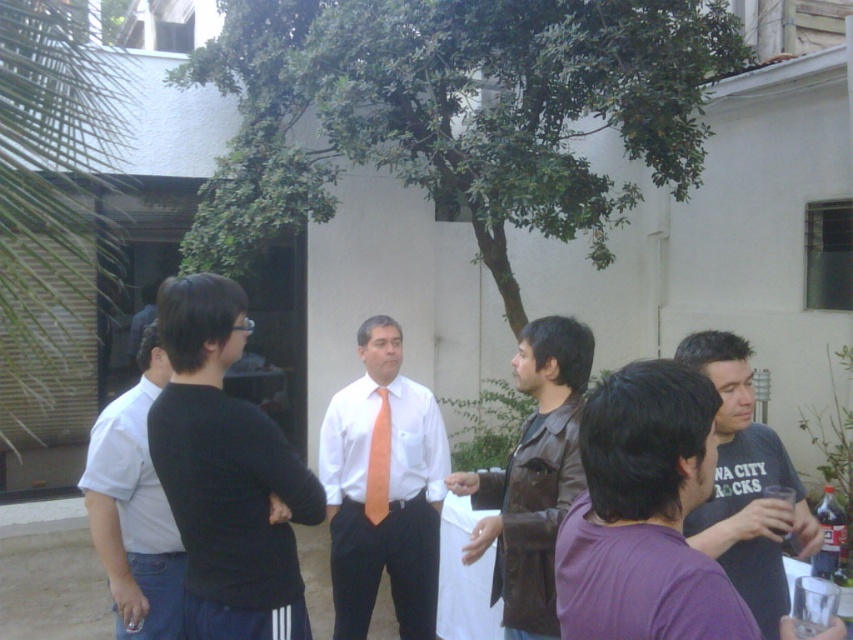
You are a photographer trying to capture a candid shot of the black matte shirt at left and the brown leather jacket at center. The camera you are using has a minimum focus distance of 80 centimeters. Will you be able to take the photo without moving either subject?

The black matte shirt at left and the brown leather jacket at center are 79.32 centimeters apart. Since the camera requires a minimum focus distance of 80 centimeters, the subjects are slightly too close to each other for the camera to focus properly. You would need to move them apart by approximately 0.68 centimeters to achieve the shot.

You are standing at the origin point in the image. Where is the black matte shirt at left relative to your position?

The black matte shirt at left is located at point [225,474], which is to the right and slightly below your current position at the origin.